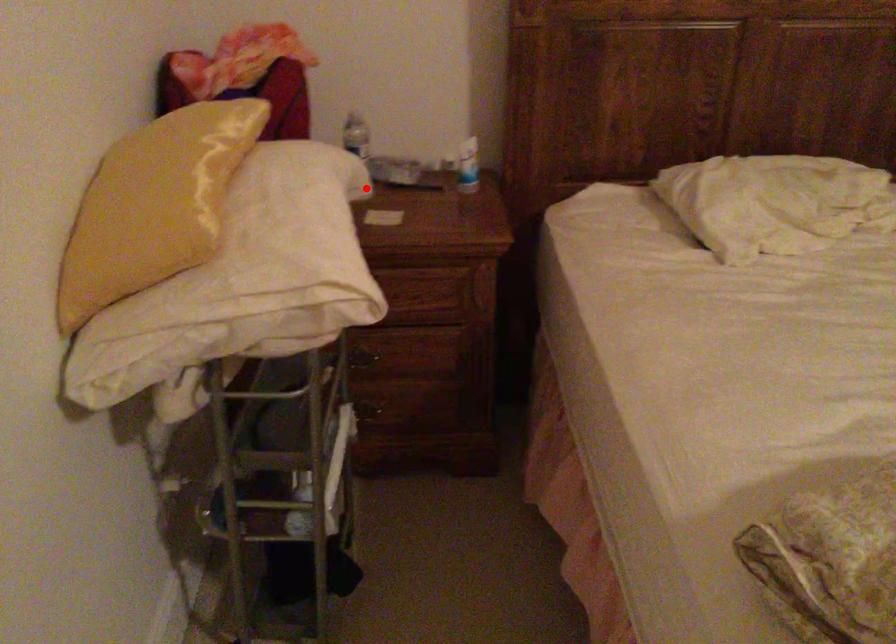
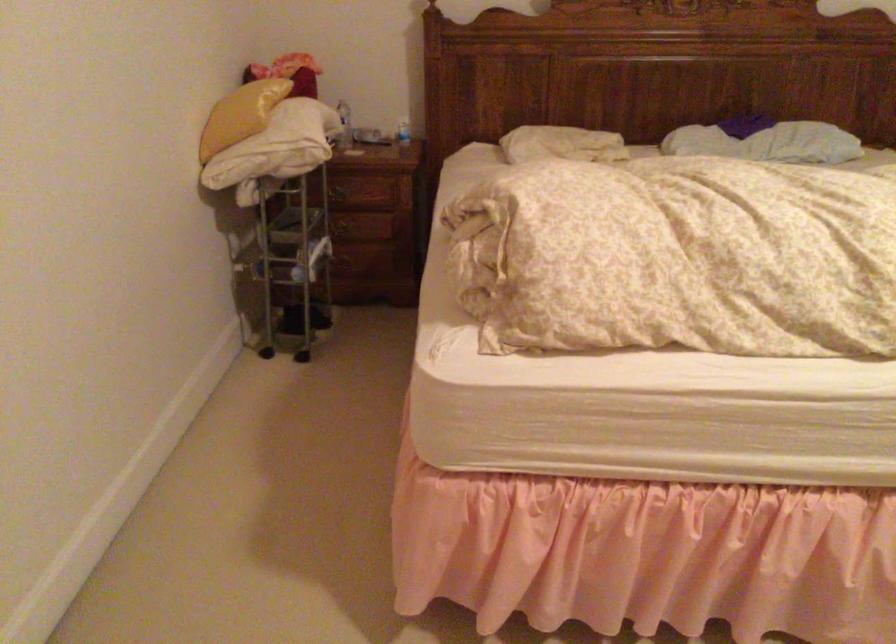
Question: I am providing you with two images of the same scene from different viewpoints. Given a red point in image1, look at the same physical point in image2. Is it:

Choices:
 (A) Closer to the viewpoint
 (B) Farther from the viewpoint

Answer: (B)